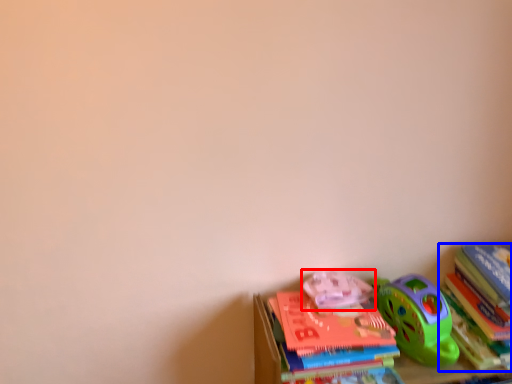
Question: Which point is further to the camera, toy (highlighted by a red box) or book (highlighted by a blue box)?

Choices:
 (A) toy
 (B) book

Answer: (A)